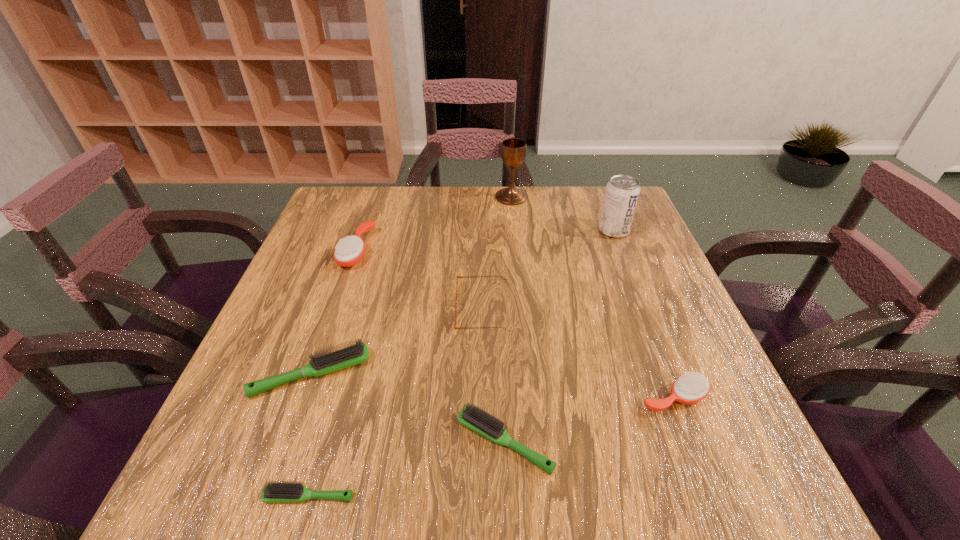
Identify the location of vacant region located 0.110m on the left of the second farthest light hairbrush. (392, 442).

Where is `free location located 0.240m on the back of the smallest light hairbrush`? The height and width of the screenshot is (540, 960). free location located 0.240m on the back of the smallest light hairbrush is located at coordinates (347, 362).

This screenshot has width=960, height=540. Identify the location of chalice present at the far edge. (513, 151).

Where is `soda can situated at the far edge`? Image resolution: width=960 pixels, height=540 pixels. soda can situated at the far edge is located at coordinates (x=622, y=192).

Locate an element on the screen. The height and width of the screenshot is (540, 960). hairbrush located at the far edge is located at coordinates (348, 251).

Where is `soda can located at the right edge`? This screenshot has height=540, width=960. soda can located at the right edge is located at coordinates (622, 192).

Locate an element on the screen. The image size is (960, 540). hairbrush at the right edge is located at coordinates (690, 388).

You are a GUI agent. You are given a task and a screenshot of the screen. Output one action in this format:
    pyautogui.click(x=<x>, y=<y>)
    Task: Click on the object present at the far left corner
    
    Given the screenshot: What is the action you would take?
    pyautogui.click(x=348, y=251)

This screenshot has width=960, height=540. In order to click on object present at the near left corner in this screenshot , I will do `click(278, 491)`.

Locate an element on the screen. The image size is (960, 540). object present at the far right corner is located at coordinates (622, 192).